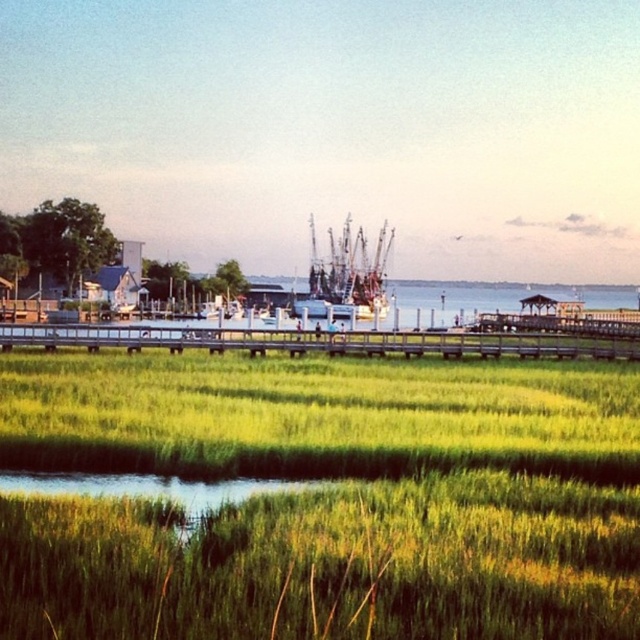
Does green grassy at center have a greater width compared to shiny metallic boat at center?

Correct, the width of green grassy at center exceeds that of shiny metallic boat at center.

Does green grassy at center have a larger size compared to shiny metallic boat at center?

Actually, green grassy at center might be smaller than shiny metallic boat at center.

Which is behind, point (148, 545) or point (332, 275)?

The point (332, 275) is behind.

Where is `green grassy at center`? green grassy at center is located at coordinates (324, 499).

Who is higher up, green grassy at center or wooden at center?

wooden at center is higher up.

Who is positioned more to the left, green grassy at center or wooden at center?

Positioned to the left is wooden at center.

Where is `green grassy at center`? The width and height of the screenshot is (640, 640). green grassy at center is located at coordinates click(x=324, y=499).

Is point (305, 337) positioned in front of point (385, 272)?

Yes, point (305, 337) is closer to viewer.

Who is more forward, (147,326) or (358,316)?

Positioned in front is point (147,326).

In order to click on wooden at center in this screenshot , I will do `click(321, 340)`.